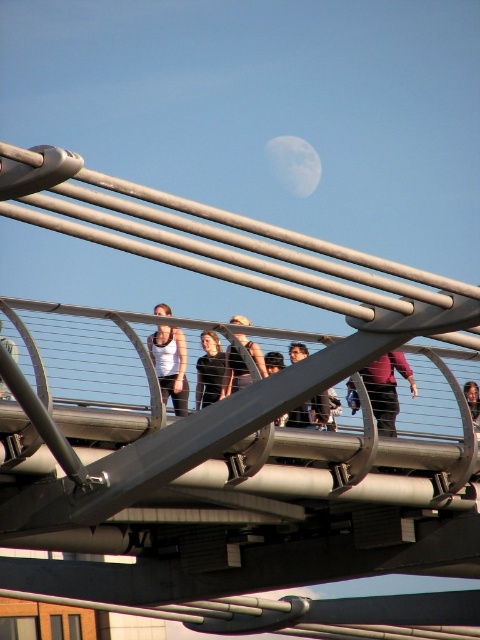
You are a photographer standing on the Millennium Bridge in London, and you want to capture a photo of the two people wearing the white matte tank top at center and matte black tank top at center. Which one is positioned to the right side of the other?

The white matte tank top at center is to the right of the matte black tank top at center.

Consider the image. You are a photographer standing on the Millennium Bridge in London. You notice two people in the center of the bridge wearing a white matte tank top at center and a black matte shirt at center. Which clothing item appears taller in the image?

The white matte tank top at center is taller than the black matte shirt at center.

You are standing on the Millennium Bridge and want to take a photo of the two points marked in the scene. Which point, point (323,417) or point (0,394), will appear closer to the camera in your photo?

Point (0,394) will appear closer to the camera in the photo because it is closer to the viewer than point (323,417), which is further away.